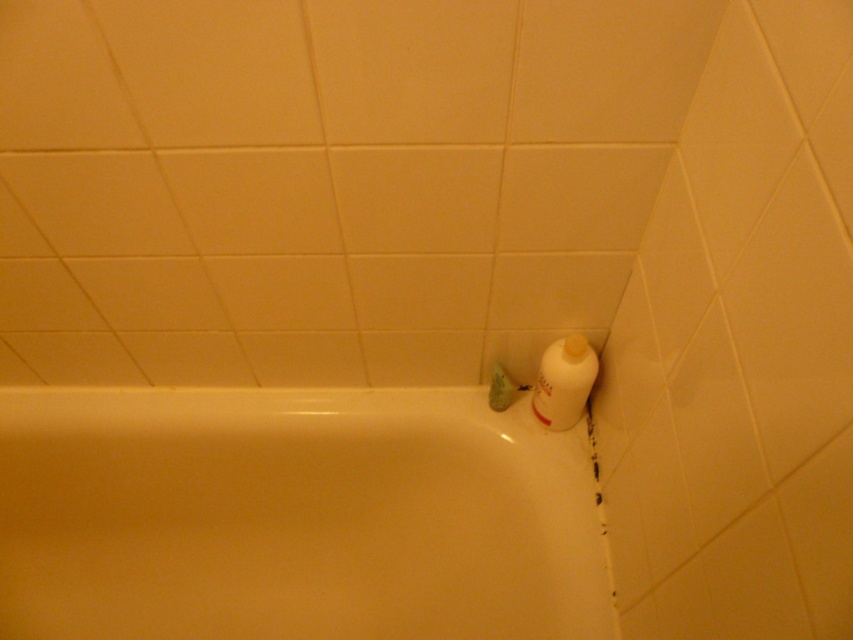
You are a bathroom cleaner trying to reach the white plastic bottle at upper right. From your position near the white glossy bathtub at lower left, which direction should you move to get closer to the bottle?

Since the white glossy bathtub at lower left is in front of the white plastic bottle at upper right, you should move backward away from the bathtub to get closer to the bottle.

From the picture: You are a bathroom cleaner and need to clean both the white glossy bathtub at lower left and the white plastic bottle at upper right. Which object requires more time to clean due to its size?

The white glossy bathtub at lower left requires more time to clean because it is bigger than the white plastic bottle at upper right.

From the picture: You are organizing items on the bathtub edge. The white plastic bottle at upper right and the green matte soap at corner are both there. If you want to place another small item between them, which side should you choose based on their widths?

The white plastic bottle at upper right is wider than the green matte soap at corner, so placing the new item between them would require choosing the side of the narrower object, which is the green matte soap at corner, to ensure enough space.